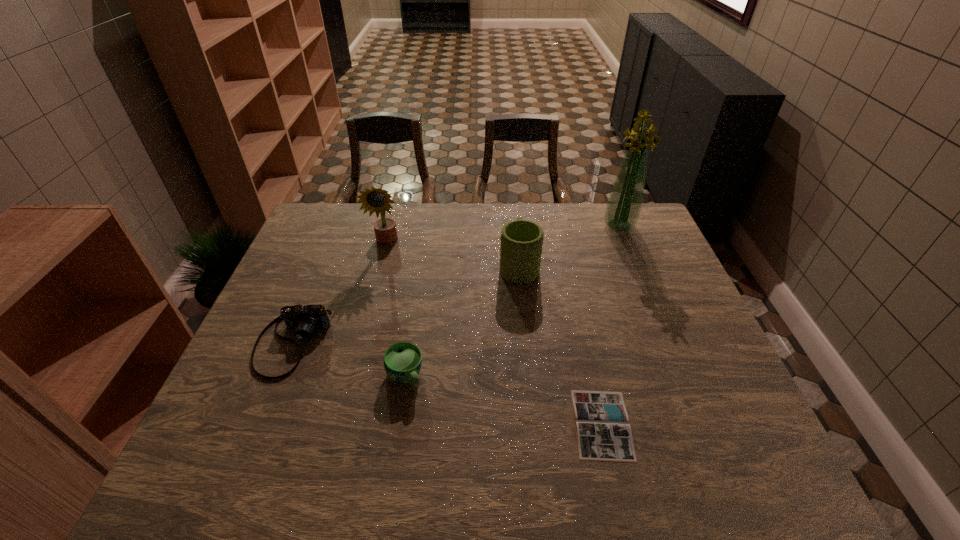
The height and width of the screenshot is (540, 960). Find the location of `bouquet`. bouquet is located at coordinates (623, 208).

Locate an element on the screen. The height and width of the screenshot is (540, 960). the rightmost object is located at coordinates (623, 208).

Where is `the fifth shortest object`? the fifth shortest object is located at coordinates (376, 200).

Find the location of a particular element. The width and height of the screenshot is (960, 540). the second object from left to right is located at coordinates (376, 200).

Where is `the fourth shortest object`? The width and height of the screenshot is (960, 540). the fourth shortest object is located at coordinates (521, 240).

Find the location of a particular element. the fourth object from left to right is located at coordinates (521, 240).

Where is `cup`? cup is located at coordinates (402, 361).

I want to click on the leftmost object, so click(x=304, y=319).

Identify the location of book. The image size is (960, 540). click(603, 432).

Locate an element on the screen. The image size is (960, 540). the fifth object from left to right is located at coordinates (603, 432).